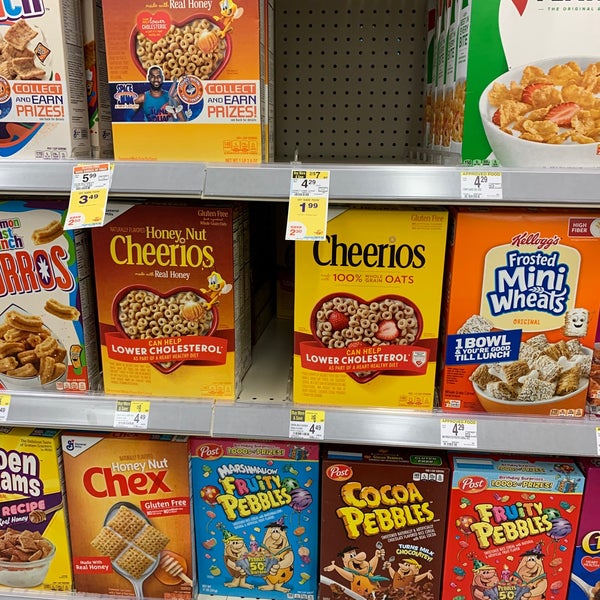
Locate an element on the screen. The width and height of the screenshot is (600, 600). top shelf of cereal is located at coordinates (46, 115), (99, 114), (177, 115), (274, 87), (508, 71), (450, 70), (441, 64), (428, 66).